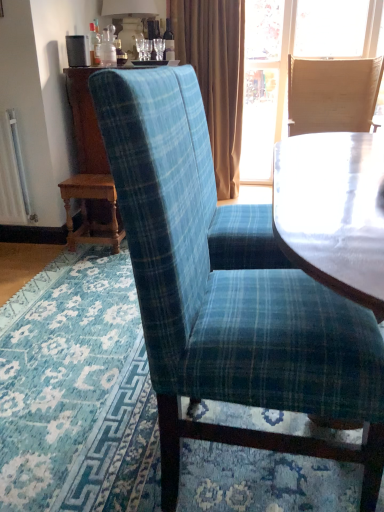
Question: Would you say wooden table at lower left is to the left or to the right of white ceramic lamp at upper center in the picture?

Choices:
 (A) left
 (B) right

Answer: (A)

Question: Is point (71, 217) positioned closer to the camera than point (135, 1)?

Choices:
 (A) closer
 (B) farther

Answer: (A)

Question: Which of these objects is positioned closest to the light brown woven chair at upper right, acting as the first chair starting from the back?

Choices:
 (A) wooden table at lower left
 (B) white ceramic lamp at upper center
 (C) brown velvet curtain at upper center
 (D) blue plaid fabric chair at center, the first chair when ordered from front to back

Answer: (C)

Question: Estimate the real-world distances between objects in this image. Which object is farther from the brown velvet curtain at upper center?

Choices:
 (A) light brown woven chair at upper right, the 2th chair from the front
 (B) white ceramic lamp at upper center
 (C) blue plaid fabric chair at center, the 2th chair viewed from the top
 (D) wooden table at lower left

Answer: (C)